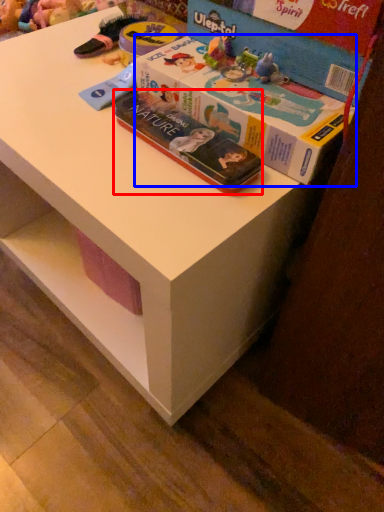
Question: Which point is closer to the camera, book (highlighted by a red box) or box (highlighted by a blue box)?

Choices:
 (A) book
 (B) box

Answer: (B)